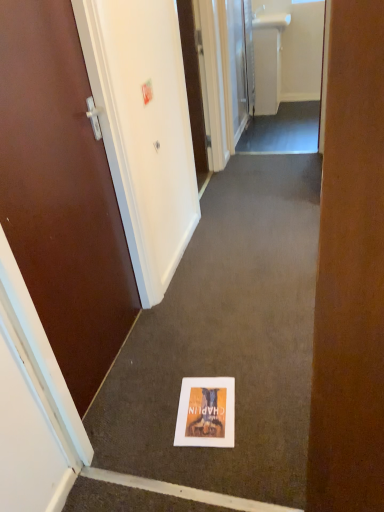
Question: From the image's perspective, is white plastic sink at upper center above matte paper flyer at center?

Choices:
 (A) yes
 (B) no

Answer: (A)

Question: From a real-world perspective, is white plastic sink at upper center located beneath matte paper flyer at center?

Choices:
 (A) no
 (B) yes

Answer: (A)

Question: Is matte paper flyer at center a part of white plastic sink at upper center?

Choices:
 (A) no
 (B) yes

Answer: (A)

Question: Is white plastic sink at upper center shorter than matte paper flyer at center?

Choices:
 (A) no
 (B) yes

Answer: (A)

Question: Is white plastic sink at upper center further to the viewer compared to matte paper flyer at center?

Choices:
 (A) yes
 (B) no

Answer: (A)

Question: Is matte paper flyer at center in front of or behind white plastic sink at upper center in the image?

Choices:
 (A) front
 (B) behind

Answer: (A)

Question: From the image's perspective, is matte paper flyer at center located above or below white plastic sink at upper center?

Choices:
 (A) above
 (B) below

Answer: (B)

Question: From their relative heights in the image, would you say matte paper flyer at center is taller or shorter than white plastic sink at upper center?

Choices:
 (A) tall
 (B) short

Answer: (B)

Question: Is matte paper flyer at center inside or outside of white plastic sink at upper center?

Choices:
 (A) inside
 (B) outside

Answer: (B)

Question: In terms of height, does white glossy sink at upper center look taller or shorter compared to brown wooden door at left, the second door viewed from the right?

Choices:
 (A) tall
 (B) short

Answer: (B)

Question: In terms of size, does white glossy sink at upper center appear bigger or smaller than brown wooden door at left, positioned as the first door in front-to-back order?

Choices:
 (A) big
 (B) small

Answer: (A)

Question: Considering their positions, is white glossy sink at upper center located in front of or behind brown wooden door at left, placed as the 1th door when sorted from left to right?

Choices:
 (A) front
 (B) behind

Answer: (B)

Question: From a real-world perspective, relative to brown wooden door at left, the 1th door in the bottom-to-top sequence, is white glossy sink at upper center vertically above or below?

Choices:
 (A) below
 (B) above

Answer: (A)

Question: From a real-world perspective, is white glossy sink at upper center physically located above or below matte paper flyer at center?

Choices:
 (A) below
 (B) above

Answer: (B)

Question: Does point (319, 53) appear closer or farther from the camera than point (182, 387)?

Choices:
 (A) farther
 (B) closer

Answer: (A)